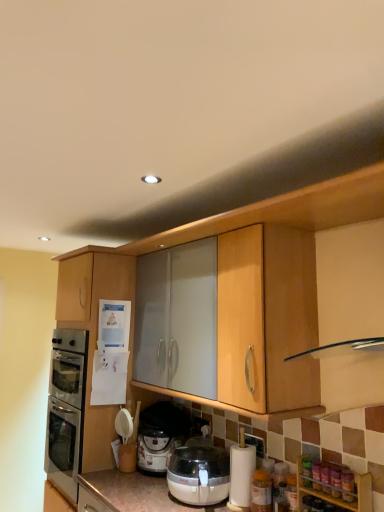
Question: Should I look upward or downward to see translucent plastic bottle at lower right, the second bottle when ordered from bottom to top?

Choices:
 (A) up
 (B) down

Answer: (B)

Question: Would you say translucent plastic bottle at lower right, placed as the 1th bottle when sorted from top to bottom, is outside wooden spice rack at lower right, the 1th cabinetry when ordered from right to left?

Choices:
 (A) no
 (B) yes

Answer: (A)

Question: Can you confirm if translucent plastic bottle at lower right, the 2th bottle positioned from the back, is bigger than wooden spice rack at lower right, which is counted as the second cabinetry, starting from the left?

Choices:
 (A) yes
 (B) no

Answer: (B)

Question: Does translucent plastic bottle at lower right, the second bottle when ordered from bottom to top, have a lesser height compared to wooden spice rack at lower right, the 1th cabinetry in the front-to-back sequence?

Choices:
 (A) no
 (B) yes

Answer: (B)

Question: Could you tell me if translucent plastic bottle at lower right, the second bottle when ordered from bottom to top, is facing wooden spice rack at lower right, the 1th cabinetry when ordered from right to left?

Choices:
 (A) no
 (B) yes

Answer: (B)

Question: Is the surface of translucent plastic bottle at lower right, the first bottle in the right-to-left sequence, in direct contact with wooden spice rack at lower right, placed as the second cabinetry when sorted from top to bottom?

Choices:
 (A) no
 (B) yes

Answer: (B)

Question: Is translucent plastic bottle at lower right, positioned as the first bottle in front-to-back order, positioned behind wooden spice rack at lower right, which is counted as the second cabinetry, starting from the left?

Choices:
 (A) yes
 (B) no

Answer: (A)

Question: Considering the relative sizes of translucent plastic bottle at lower right, which is the first bottle from left to right, and translucent plastic bottle at lower right, the first bottle in the right-to-left sequence, in the image provided, is translucent plastic bottle at lower right, which is the first bottle from left to right, thinner than translucent plastic bottle at lower right, the first bottle in the right-to-left sequence,?

Choices:
 (A) yes
 (B) no

Answer: (B)

Question: Considering the relative sizes of translucent plastic bottle at lower right, acting as the 1th bottle starting from the back, and translucent plastic bottle at lower right, arranged as the 2th bottle when viewed from the left, in the image provided, is translucent plastic bottle at lower right, acting as the 1th bottle starting from the back, bigger than translucent plastic bottle at lower right, arranged as the 2th bottle when viewed from the left,?

Choices:
 (A) yes
 (B) no

Answer: (A)

Question: Does translucent plastic bottle at lower right, placed as the second bottle when sorted from right to left, have a greater height compared to translucent plastic bottle at lower right, the second bottle when ordered from bottom to top?

Choices:
 (A) yes
 (B) no

Answer: (A)

Question: Is translucent plastic bottle at lower right, which is the first bottle from left to right, to the left of translucent plastic bottle at lower right, the 2th bottle positioned from the back, from the viewer's perspective?

Choices:
 (A) no
 (B) yes

Answer: (B)

Question: Does translucent plastic bottle at lower right, placed as the second bottle when sorted from right to left, touch translucent plastic bottle at lower right, the 2th bottle positioned from the back?

Choices:
 (A) yes
 (B) no

Answer: (B)

Question: From a real-world perspective, does translucent plastic bottle at lower right, which appears as the 2th bottle when viewed from the front, stand above translucent plastic bottle at lower right, placed as the 1th bottle when sorted from top to bottom?

Choices:
 (A) no
 (B) yes

Answer: (A)

Question: From a real-world perspective, is matte wood cabinet at left, the second cabinetry from the front, under translucent plastic pressure cooker at lower center?

Choices:
 (A) yes
 (B) no

Answer: (B)